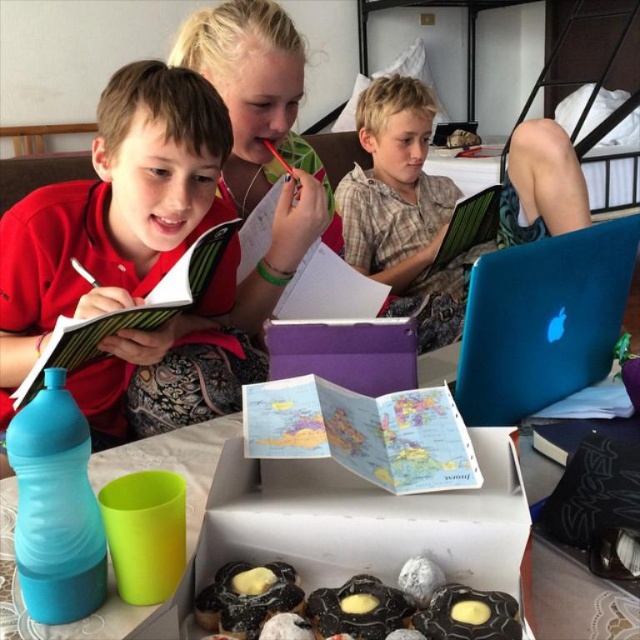
Question: Based on their relative distances, which object is farther from the blue matte laptop at upper right?

Choices:
 (A) dark chocolate cake at lower center
 (B) matte black notebook at left
 (C) chocolate glazed pastry at lower center
 (D) blue glossy laptop at upper right

Answer: (D)

Question: Which point is farther to the camera?

Choices:
 (A) wooden bunk bed at upper center
 (B) dark chocolate cake at lower center
 (C) white paper map at center
 (D) blue glossy laptop at center

Answer: (A)

Question: Is white paper map at center smaller than blue glossy laptop at center?

Choices:
 (A) yes
 (B) no

Answer: (A)

Question: Does blue glossy laptop at upper right appear over glazed chocolate pastry at center?

Choices:
 (A) yes
 (B) no

Answer: (A)

Question: Does dark chocolate cake at lower center have a larger size compared to blue glossy laptop at center?

Choices:
 (A) yes
 (B) no

Answer: (B)

Question: Which object appears closest to the camera in this image?

Choices:
 (A) chocolate glaze pastry at center
 (B) blue glossy laptop at center
 (C) wooden bunk bed at upper center

Answer: (A)